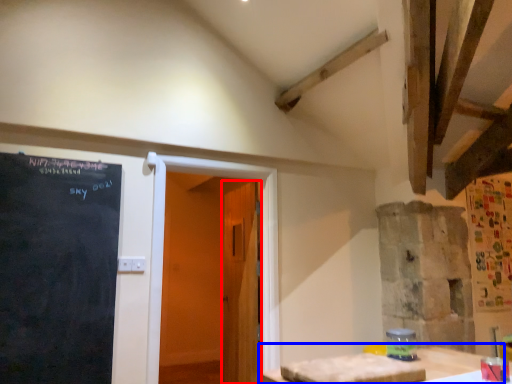
Question: Which object appears farthest to the camera in this image, door (highlighted by a red box) or table (highlighted by a blue box)?

Choices:
 (A) door
 (B) table

Answer: (A)